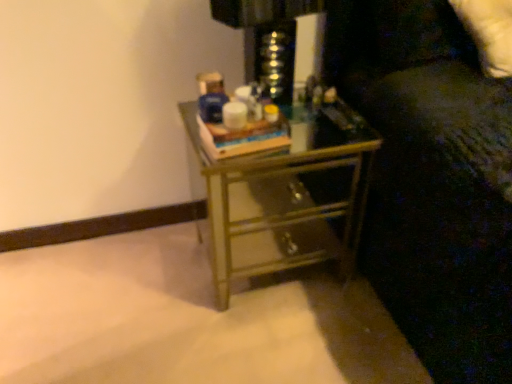
Find the location of a particular element. free spot in front of metallic gold nightstand at center is located at coordinates (272, 342).